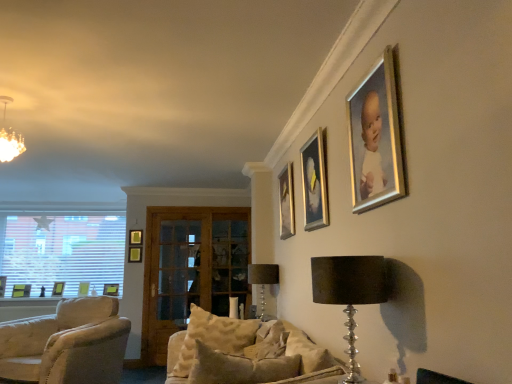
How much space does matte black picture frame at lower left, arranged as the fourth picture frame when viewed from the back, occupy vertically?

matte black picture frame at lower left, arranged as the fourth picture frame when viewed from the back, is 10.77 inches in height.

Describe the element at coordinates (21, 290) in the screenshot. I see `matte black picture frame at lower left, which is the first picture frame from left to right` at that location.

Locate an element on the screen. matte gold chandelier at upper left is located at coordinates (9, 138).

Measure the distance between matte gold chandelier at upper left and camera.

3.16 meters.

What is the approximate height of matte green picture frame at lower left, which ranks as the 5th picture frame in front-to-back order?

matte green picture frame at lower left, which ranks as the 5th picture frame in front-to-back order, is 10.20 inches tall.

This screenshot has width=512, height=384. I want to click on textured beige pillow at center, so click(x=213, y=337).

This screenshot has height=384, width=512. What do you see at coordinates (286, 202) in the screenshot?
I see `metallic gold picture frame at upper center, placed as the fifth picture frame when sorted from left to right` at bounding box center [286, 202].

Locate an element on the screen. The height and width of the screenshot is (384, 512). silver/golden frame at upper right, placed as the first picture frame when sorted from front to back is located at coordinates (376, 138).

This screenshot has width=512, height=384. Describe the element at coordinates (376, 138) in the screenshot. I see `silver/golden frame at upper right, which is counted as the seventh picture frame, starting from the left` at that location.

Where is `matte black picture frame at lower left, the seventh picture frame positioned from the right`? matte black picture frame at lower left, the seventh picture frame positioned from the right is located at coordinates (21, 290).

What are the coordinates of `picture frame that is the 4th one above the matte green picture frame at lower left, positioned as the 5th picture frame in right-to-left order (from a real-world perspective)` in the screenshot? It's located at (376, 138).

Could you measure the distance between matte green picture frame at lower left, the sixth picture frame from the front, and silver/golden frame at upper right, placed as the first picture frame when sorted from front to back?

A distance of 5.68 meters exists between matte green picture frame at lower left, the sixth picture frame from the front, and silver/golden frame at upper right, placed as the first picture frame when sorted from front to back.

Is matte green picture frame at lower left, the sixth picture frame from the front, facing away from silver/golden frame at upper right, arranged as the 7th picture frame when viewed from the back?

No.

Considering the relative sizes of matte green picture frame at lower left, arranged as the 3th picture frame when viewed from the left, and silver/golden frame at upper right, arranged as the 7th picture frame when viewed from the back, in the image provided, is matte green picture frame at lower left, arranged as the 3th picture frame when viewed from the left, shorter than silver/golden frame at upper right, arranged as the 7th picture frame when viewed from the back,?

Indeed, matte green picture frame at lower left, arranged as the 3th picture frame when viewed from the left, has a lesser height compared to silver/golden frame at upper right, arranged as the 7th picture frame when viewed from the back.

Is matte black picture frame at lower left, arranged as the fourth picture frame when viewed from the back, shorter than clear glass door at center, which appears as the second glass door when viewed from the left?

Indeed, matte black picture frame at lower left, arranged as the fourth picture frame when viewed from the back, has a lesser height compared to clear glass door at center, which appears as the second glass door when viewed from the left.

Can you confirm if matte black picture frame at lower left, positioned as the 4th picture frame in front-to-back order, is wider than clear glass door at center, which appears as the second glass door when viewed from the left?

Indeed, matte black picture frame at lower left, positioned as the 4th picture frame in front-to-back order, has a greater width compared to clear glass door at center, which appears as the second glass door when viewed from the left.

Does matte black picture frame at lower left, the seventh picture frame positioned from the right, appear on the right side of clear glass door at center, the 1th glass door positioned from the right?

Incorrect, matte black picture frame at lower left, the seventh picture frame positioned from the right, is not on the right side of clear glass door at center, the 1th glass door positioned from the right.

Is the surface of wooden picture frame at upper center, the fourth picture frame viewed from the left, in direct contact with shiny silver table lamp at lower right, the 1th table lamp positioned from the top?

No, wooden picture frame at upper center, the fourth picture frame viewed from the left, is not making contact with shiny silver table lamp at lower right, the 1th table lamp positioned from the top.

Is wooden picture frame at upper center, the fourth picture frame viewed from the left, to the right of shiny silver table lamp at lower right, which is the 1th table lamp in front-to-back order, from the viewer's perspective?

In fact, wooden picture frame at upper center, the fourth picture frame viewed from the left, is to the left of shiny silver table lamp at lower right, which is the 1th table lamp in front-to-back order.

Is wooden picture frame at upper center, the 7th picture frame when ordered from front to back, wider than shiny silver table lamp at lower right, which is the 1th table lamp in front-to-back order?

No.

Between wooden picture frame at upper center, placed as the first picture frame when sorted from back to front, and shiny silver table lamp at lower right, acting as the second table lamp starting from the left, which one has larger size?

Bigger between the two is shiny silver table lamp at lower right, acting as the second table lamp starting from the left.

Between clear glass door at center, which appears as the second glass door when viewed from the left, and shiny silver table lamp at lower right, which is the 1th table lamp in front-to-back order, which one appears on the right side from the viewer's perspective?

shiny silver table lamp at lower right, which is the 1th table lamp in front-to-back order.

Is clear glass door at center, the 1th glass door positioned from the right, shorter than shiny silver table lamp at lower right, which is the 1th table lamp in front-to-back order?

No, clear glass door at center, the 1th glass door positioned from the right, is not shorter than shiny silver table lamp at lower right, which is the 1th table lamp in front-to-back order.

Is clear glass door at center, which appears as the second glass door when viewed from the left, positioned with its back to shiny silver table lamp at lower right, acting as the 1th table lamp starting from the right?

clear glass door at center, which appears as the second glass door when viewed from the left, is not turned away from shiny silver table lamp at lower right, acting as the 1th table lamp starting from the right.

Is wooden picture frame at upper center, placed as the 4th picture frame when sorted from right to left, beside metallic gold picture frame at upper center, placed as the fifth picture frame when sorted from left to right?

There is a gap between wooden picture frame at upper center, placed as the 4th picture frame when sorted from right to left, and metallic gold picture frame at upper center, placed as the fifth picture frame when sorted from left to right.

Does wooden picture frame at upper center, the fourth picture frame viewed from the left, come in front of metallic gold picture frame at upper center, placed as the third picture frame when sorted from right to left?

No, wooden picture frame at upper center, the fourth picture frame viewed from the left, is further to the viewer.

Visually, is wooden picture frame at upper center, placed as the first picture frame when sorted from back to front, positioned to the left or to the right of metallic gold picture frame at upper center, which is the 3th picture frame in front-to-back order?

In the image, wooden picture frame at upper center, placed as the first picture frame when sorted from back to front, appears on the left side of metallic gold picture frame at upper center, which is the 3th picture frame in front-to-back order.

Based on the photo, considering the relative sizes of wooden picture frame at upper center, placed as the 4th picture frame when sorted from right to left, and metallic gold picture frame at upper center, marked as the 5th picture frame in a back-to-front arrangement, in the image provided, is wooden picture frame at upper center, placed as the 4th picture frame when sorted from right to left, wider than metallic gold picture frame at upper center, marked as the 5th picture frame in a back-to-front arrangement,?

Yes, wooden picture frame at upper center, placed as the 4th picture frame when sorted from right to left, is wider than metallic gold picture frame at upper center, marked as the 5th picture frame in a back-to-front arrangement.

From a real-world perspective, is textured beige pillow at center located higher than shiny silver table lamp at lower right, acting as the 1th table lamp starting from the right?

No.

From the image's perspective, between textured beige pillow at center and shiny silver table lamp at lower right, which is the 1th table lamp in front-to-back order, which one is located above?

shiny silver table lamp at lower right, which is the 1th table lamp in front-to-back order, appears higher in the image.

Is textured beige pillow at center surrounding shiny silver table lamp at lower right, the 1th table lamp positioned from the top?

No, shiny silver table lamp at lower right, the 1th table lamp positioned from the top, is not a part of textured beige pillow at center.

Who is shorter, textured beige pillow at center or shiny silver table lamp at lower right, the 1th table lamp positioned from the top?

With less height is shiny silver table lamp at lower right, the 1th table lamp positioned from the top.

Can you confirm if clear glass door at center, which is the first glass door from left to right, is positioned to the left of beige fabric couch at center?

Yes, clear glass door at center, which is the first glass door from left to right, is to the left of beige fabric couch at center.

Between clear glass door at center, placed as the 2th glass door when sorted from right to left, and beige fabric couch at center, which one has smaller width?

clear glass door at center, placed as the 2th glass door when sorted from right to left, is thinner.

From the image's perspective, is clear glass door at center, placed as the 2th glass door when sorted from right to left, above or below beige fabric couch at center?

Based on their image positions, clear glass door at center, placed as the 2th glass door when sorted from right to left, is located beneath beige fabric couch at center.

How many degrees apart are the facing directions of clear glass door at center, placed as the 2th glass door when sorted from right to left, and beige fabric couch at center?

The angle between the facing direction of clear glass door at center, placed as the 2th glass door when sorted from right to left, and the facing direction of beige fabric couch at center is 165 degrees.

Locate an element on the screen. The height and width of the screenshot is (384, 512). the 5th picture frame in front when counting from the matte green picture frame at lower left, the sixth picture frame from the front is located at coordinates (376, 138).

Locate an element on the screen. The image size is (512, 384). the 2nd picture frame directly beneath the clear glass door at center, the 1th glass door positioned from the right (from a real-world perspective) is located at coordinates (21, 290).

From the image, which object appears to be nearer to matte black picture frame at lower left, arranged as the fourth picture frame when viewed from the back, clear glass door at center, the 1th glass door positioned from the right, or metallic gold picture frame at upper center, which is the 3th picture frame in front-to-back order?

The object closer to matte black picture frame at lower left, arranged as the fourth picture frame when viewed from the back, is clear glass door at center, the 1th glass door positioned from the right.

Which object lies nearer to the anchor point wooden picture frame at upper center, the fourth picture frame viewed from the left, shiny silver table lamp at lower right, the 2th table lamp from the back, or gold-framed picture at upper center, the 2th picture frame from the front?

gold-framed picture at upper center, the 2th picture frame from the front, is closer to wooden picture frame at upper center, the fourth picture frame viewed from the left.

Looking at the image, which one is located closer to clear glass door at center, which is the first glass door from left to right, matte green picture frame at lower left, which ranks as the 5th picture frame in front-to-back order, or clear glass door at center, the 1th glass door positioned from the right?

clear glass door at center, the 1th glass door positioned from the right, is positioned closer to the anchor clear glass door at center, which is the first glass door from left to right.

Estimate the real-world distances between objects in this image. Which object is further from wooden picture frame at upper center, placed as the 4th picture frame when sorted from right to left, clear glass door at center, placed as the 2th glass door when sorted from right to left, or textured beige pillow at center?

textured beige pillow at center is further to wooden picture frame at upper center, placed as the 4th picture frame when sorted from right to left.

Estimate the real-world distances between objects in this image. Which object is closer to textured beige pillow at center, metallic gold picture frame at upper center, placed as the third picture frame when sorted from right to left, or beige fabric couch at center?

beige fabric couch at center is closer to textured beige pillow at center.

Estimate the real-world distances between objects in this image. Which object is closer to matte gold chandelier at upper left, white blinds at left or textured beige pillow at center?

Based on the image, textured beige pillow at center appears to be nearer to matte gold chandelier at upper left.

When comparing their distances from matte gold chandelier at upper left, does matte black picture frame at lower left, the seventh picture frame positioned from the right, or shiny silver table lamp at lower right, which is the 1th table lamp in front-to-back order, seem further?

matte black picture frame at lower left, the seventh picture frame positioned from the right.

Looking at the image, which one is located closer to matte black picture frame at lower left, the seventh picture frame positioned from the right, silver/golden frame at upper right, placed as the first picture frame when sorted from front to back, or beige fabric couch at center?

Based on the image, beige fabric couch at center appears to be nearer to matte black picture frame at lower left, the seventh picture frame positioned from the right.

Where is `pillow between silver/golden frame at upper right, arranged as the 7th picture frame when viewed from the back, and satin black table lamp at center, which is the 1th table lamp in left-to-right order, along the z-axis`? The height and width of the screenshot is (384, 512). pillow between silver/golden frame at upper right, arranged as the 7th picture frame when viewed from the back, and satin black table lamp at center, which is the 1th table lamp in left-to-right order, along the z-axis is located at coordinates (213, 337).

This screenshot has height=384, width=512. I want to click on studio couch located between silver/golden frame at upper right, which is counted as the seventh picture frame, starting from the left, and metallic gold picture frame at upper center, placed as the third picture frame when sorted from right to left, in the depth direction, so click(x=244, y=353).

Identify the location of studio couch positioned between silver/golden frame at upper right, acting as the 1th picture frame starting from the right, and matte black picture frame at lower left, the seventh picture frame positioned from the right, from near to far. The width and height of the screenshot is (512, 384). (244, 353).

Locate an element on the screen. The image size is (512, 384). studio couch between matte gold chandelier at upper left and shiny silver table lamp at lower right, the 2th table lamp from the back, from left to right is located at coordinates (244, 353).